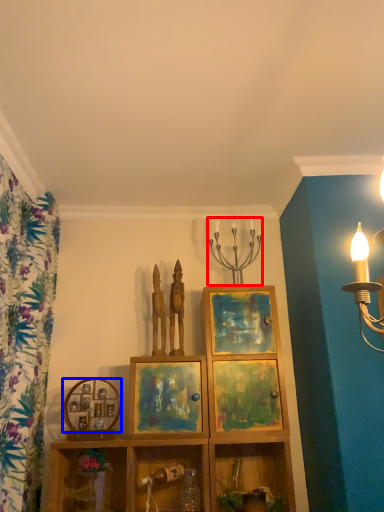
Question: Which object is further to the camera taking this photo, candle holder (highlighted by a red box) or picture frame (highlighted by a blue box)?

Choices:
 (A) candle holder
 (B) picture frame

Answer: (A)